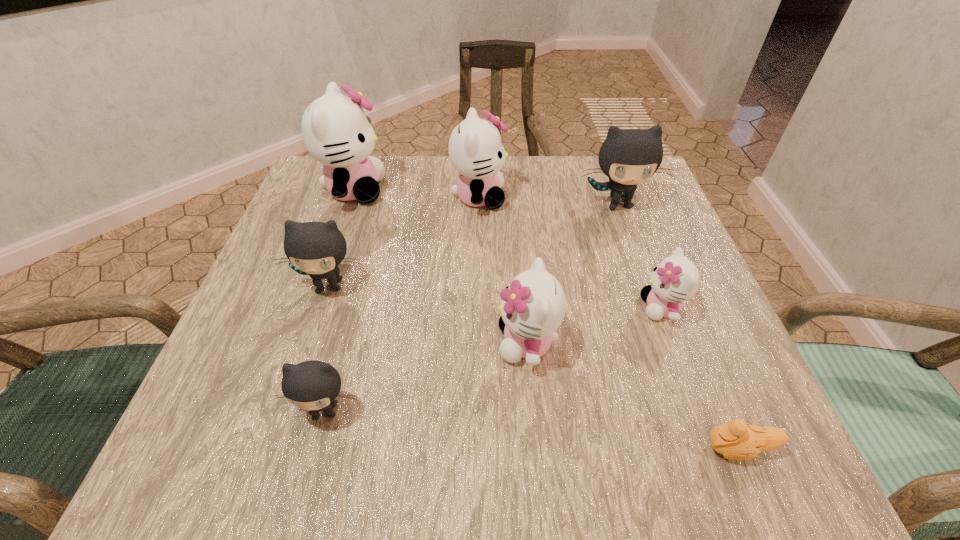
What are the coordinates of `duckling` in the screenshot? It's located at (737, 440).

This screenshot has width=960, height=540. What are the coordinates of `the nearest object` in the screenshot? It's located at (737, 440).

Identify the location of free location located on the front-facing side of the tallest kitten. click(522, 190).

In order to click on vacant space located on the front-facing side of the third smallest white kitten in this screenshot , I will do `click(566, 197)`.

Locate an element on the screen. The width and height of the screenshot is (960, 540). vacant region located 0.060m on the front-facing side of the farthest gray kitten is located at coordinates (x=629, y=237).

In order to click on vacant space located on the front-facing side of the second smallest white kitten in this screenshot , I will do `click(454, 342)`.

Identify the location of vacant space situated 0.290m on the front-facing side of the second smallest white kitten. (322, 342).

Where is `vacant space located on the front-facing side of the second smallest white kitten`? This screenshot has width=960, height=540. vacant space located on the front-facing side of the second smallest white kitten is located at coordinates (268, 342).

Identify the location of free location located 0.090m on the front-facing side of the second smallest gray kitten. (311, 343).

The width and height of the screenshot is (960, 540). Find the location of `vacant space located 0.320m on the front-facing side of the rightmost white kitten`. vacant space located 0.320m on the front-facing side of the rightmost white kitten is located at coordinates (461, 307).